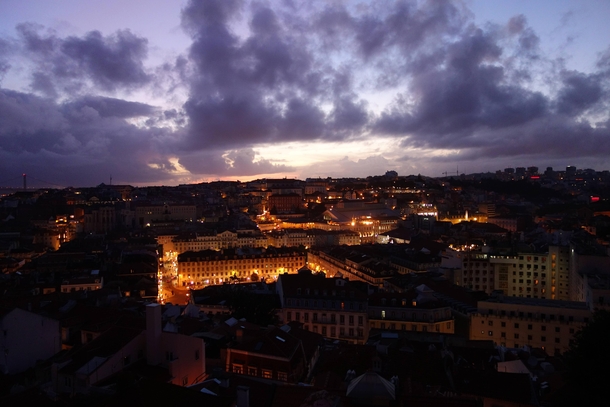
The image size is (610, 407). I want to click on pink chimney, so click(x=152, y=335).